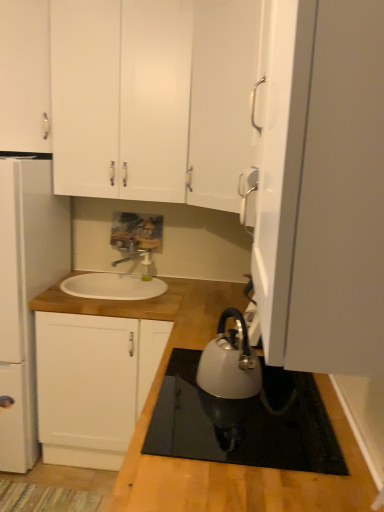
Question: Should I look upward or downward to see satin silver kettle at lower center?

Choices:
 (A) down
 (B) up

Answer: (A)

Question: Does white matte refrigerator at left lie in front of white matte cabinet at upper center, the second cabinetry positioned from the top?

Choices:
 (A) yes
 (B) no

Answer: (A)

Question: Is white matte refrigerator at left facing away from white matte cabinet at upper center, placed as the second cabinetry when sorted from bottom to top?

Choices:
 (A) no
 (B) yes

Answer: (A)

Question: Can you see white matte refrigerator at left touching white matte cabinet at upper center, the second cabinetry positioned from the top?

Choices:
 (A) no
 (B) yes

Answer: (A)

Question: Is white matte refrigerator at left further to the viewer compared to white matte cabinet at upper center, placed as the second cabinetry when sorted from bottom to top?

Choices:
 (A) no
 (B) yes

Answer: (A)

Question: Can you confirm if white matte refrigerator at left is smaller than white matte cabinet at upper center, the second cabinetry positioned from the top?

Choices:
 (A) no
 (B) yes

Answer: (A)

Question: Is white matte refrigerator at left at the left side of white matte cabinet at upper center, placed as the second cabinetry when sorted from bottom to top?

Choices:
 (A) yes
 (B) no

Answer: (A)

Question: Is white matte cabinet at upper left, marked as the first cabinetry in a top-to-bottom arrangement, at the back of white matte refrigerator at left?

Choices:
 (A) yes
 (B) no

Answer: (B)

Question: From a real-world perspective, is white matte refrigerator at left located beneath white matte cabinet at upper left, marked as the first cabinetry in a top-to-bottom arrangement?

Choices:
 (A) no
 (B) yes

Answer: (B)

Question: Can you confirm if white matte refrigerator at left is smaller than white matte cabinet at upper left, the third cabinetry from the bottom?

Choices:
 (A) yes
 (B) no

Answer: (B)

Question: Can you confirm if white matte refrigerator at left is bigger than white matte cabinet at upper left, marked as the first cabinetry in a top-to-bottom arrangement?

Choices:
 (A) yes
 (B) no

Answer: (A)

Question: Is white matte refrigerator at left at the right side of white matte cabinet at upper left, marked as the first cabinetry in a top-to-bottom arrangement?

Choices:
 (A) yes
 (B) no

Answer: (B)

Question: Is white matte refrigerator at left aimed at white matte cabinet at upper left, marked as the first cabinetry in a top-to-bottom arrangement?

Choices:
 (A) no
 (B) yes

Answer: (A)

Question: Are white wood cabinet at center, acting as the third cabinetry starting from the top, and silver metallic faucet at center located far from each other?

Choices:
 (A) yes
 (B) no

Answer: (B)